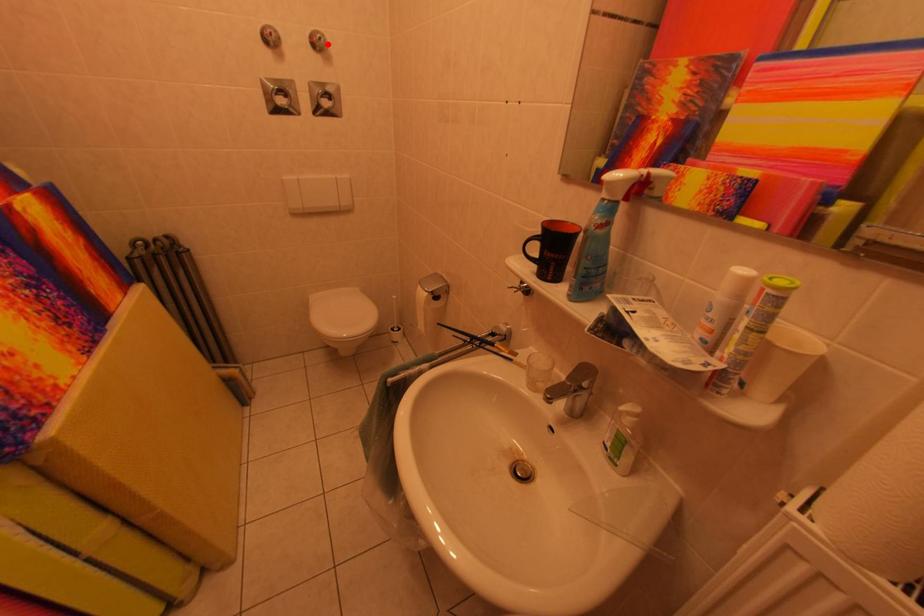
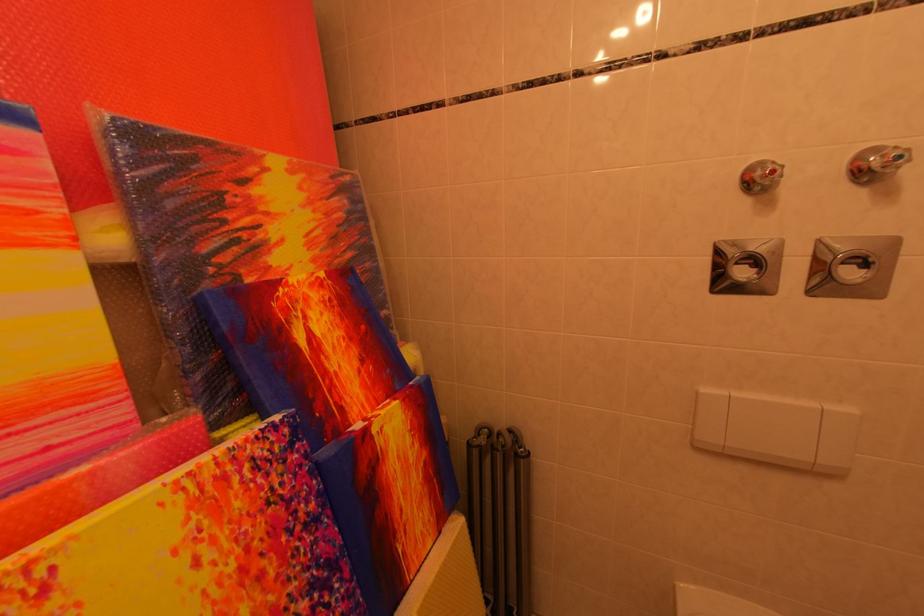
The point at the highlighted location is marked in the first image. Where is the corresponding point in the second image?

(907, 161)